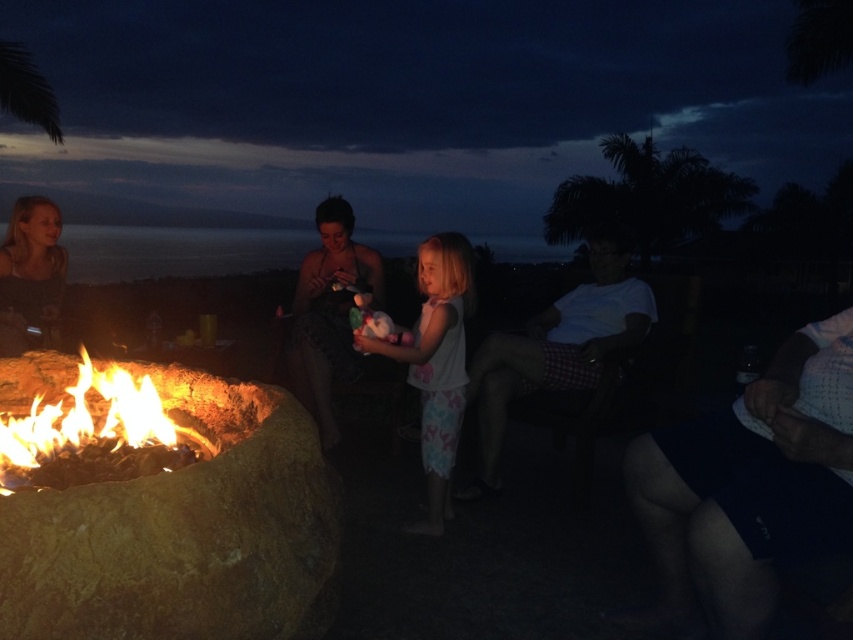
You are planning to take a photo of the nighttime gathering scene. You need to ensure that both the matte black dress at center and the blonde hair at upper left are clearly visible in the frame. Given their sizes, which object should you focus on to ensure both are in focus?

The matte black dress at center is wider than the blonde hair at upper left, so focusing on the matte black dress at center would ensure both are in focus since it is larger and occupies more space in the frame.

You are organizing a costume party and need to ensure that all guests have matching outfits. You notice two white cotton garments in the scene. Which garment has a wider width, the white cotton shirt at right or the white cotton dress at center?

The white cotton shirt at right has a larger width than the white cotton dress at center according to the description.